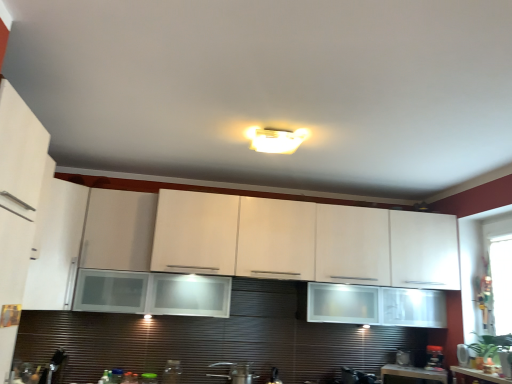
Question: Is metallic silver toaster at lower center, marked as the second appliance in a left-to-right arrangement, not inside white glossy countertop at lower right?

Choices:
 (A) yes
 (B) no

Answer: (A)

Question: Considering the relative positions of metallic silver toaster at lower center, which is the sixth appliance from right to left, and white glossy countertop at lower right in the image provided, is metallic silver toaster at lower center, which is the sixth appliance from right to left, behind white glossy countertop at lower right?

Choices:
 (A) no
 (B) yes

Answer: (A)

Question: Can you confirm if metallic silver toaster at lower center, marked as the second appliance in a left-to-right arrangement, is positioned to the right of white glossy countertop at lower right?

Choices:
 (A) no
 (B) yes

Answer: (A)

Question: Considering the relative sizes of metallic silver toaster at lower center, which is the sixth appliance from right to left, and white glossy countertop at lower right in the image provided, is metallic silver toaster at lower center, which is the sixth appliance from right to left, smaller than white glossy countertop at lower right?

Choices:
 (A) yes
 (B) no

Answer: (A)

Question: From a real-world perspective, is metallic silver toaster at lower center, which is the sixth appliance from right to left, located beneath white glossy countertop at lower right?

Choices:
 (A) yes
 (B) no

Answer: (A)

Question: Can you confirm if metallic silver toaster at lower center, marked as the second appliance in a left-to-right arrangement, is thinner than white glossy countertop at lower right?

Choices:
 (A) yes
 (B) no

Answer: (A)

Question: Is white glossy cabinet at upper center, which appears as the first cabinetry when viewed from the right, to the left of black plastic coffee maker at lower right, placed as the sixth appliance when sorted from left to right, from the viewer's perspective?

Choices:
 (A) yes
 (B) no

Answer: (A)

Question: Is white glossy cabinet at upper center, the 2th cabinetry positioned from the left, in front of black plastic coffee maker at lower right, the second appliance when ordered from right to left?

Choices:
 (A) no
 (B) yes

Answer: (B)

Question: Is white glossy cabinet at upper center, which appears as the first cabinetry when viewed from the right, to the right of black plastic coffee maker at lower right, the second appliance when ordered from right to left, from the viewer's perspective?

Choices:
 (A) yes
 (B) no

Answer: (B)

Question: Does white glossy cabinet at upper center, which appears as the first cabinetry when viewed from the right, have a lesser height compared to black plastic coffee maker at lower right, placed as the sixth appliance when sorted from left to right?

Choices:
 (A) yes
 (B) no

Answer: (B)

Question: From a real-world perspective, is white glossy cabinet at upper center, the 2th cabinetry positioned from the left, physically above black plastic coffee maker at lower right, the second appliance when ordered from right to left?

Choices:
 (A) no
 (B) yes

Answer: (B)

Question: Is white glossy cabinet at upper center, which appears as the first cabinetry when viewed from the right, wider than black plastic coffee maker at lower right, the second appliance when ordered from right to left?

Choices:
 (A) yes
 (B) no

Answer: (A)

Question: Is white matte cabinet at left, marked as the 2th cabinetry in a right-to-left arrangement, outside green plastic lid at lower center, the 7th appliance from the right?

Choices:
 (A) yes
 (B) no

Answer: (A)